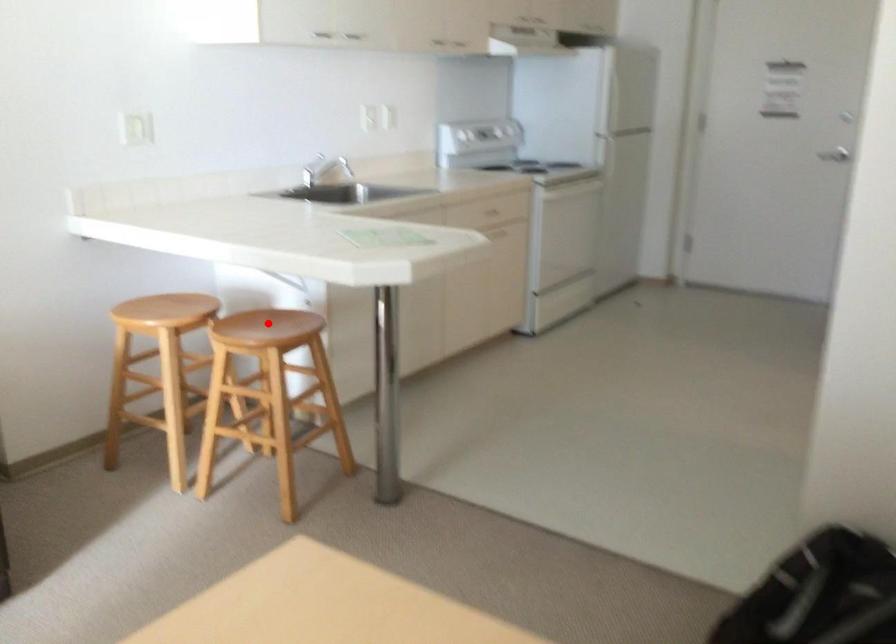
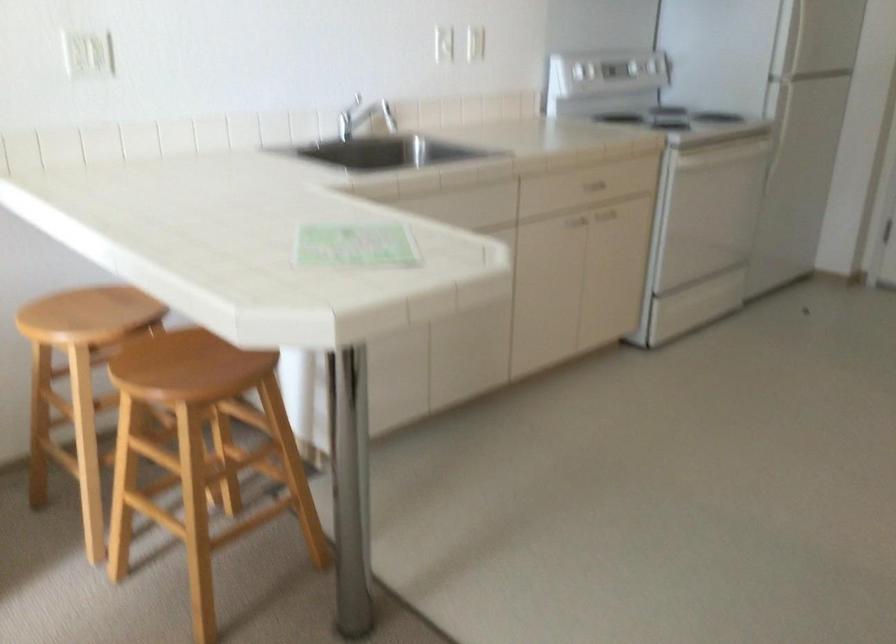
Question: I am providing you with two images of the same scene from different viewpoints. In image1, a red point is highlighted. Considering the same 3D point in image2, which of the following is correct?

Choices:
 (A) It is closer
 (B) It is farther

Answer: (A)